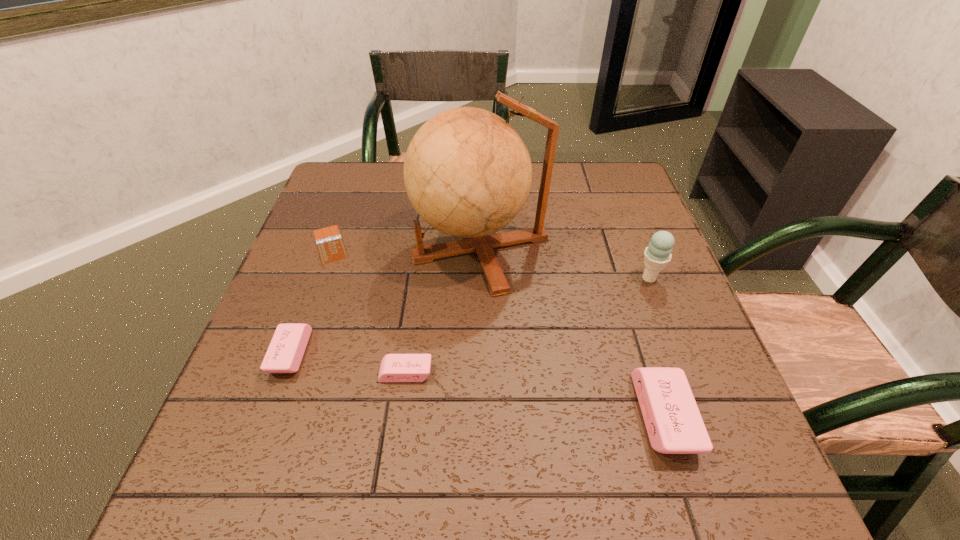
At what (x,y) coordinates should I click in order to perform the action: click on chocolate bar present at the left edge. Please return your answer as a coordinate pair (x, y). Image resolution: width=960 pixels, height=540 pixels. Looking at the image, I should click on (330, 245).

Where is `eraser located in the right edge section of the desktop`? The image size is (960, 540). eraser located in the right edge section of the desktop is located at coordinates (674, 424).

This screenshot has width=960, height=540. I want to click on ice cream at the right edge, so click(x=657, y=255).

Locate an element on the screen. object positioned at the near right corner is located at coordinates (674, 424).

You are a GUI agent. You are given a task and a screenshot of the screen. Output one action in this format:
    pyautogui.click(x=<x>, y=<y>)
    Task: Click on the free space at the far edge of the desktop
    This screenshot has height=540, width=960.
    Given the screenshot: What is the action you would take?
    pyautogui.click(x=571, y=193)

The height and width of the screenshot is (540, 960). Identify the location of free space at the right edge of the desktop. (641, 223).

Locate an element on the screen. The image size is (960, 540). vacant area at the far left corner is located at coordinates (365, 195).

At what (x,y) coordinates should I click in order to perform the action: click on free space at the far right corner of the desktop. Please return your answer as a coordinate pair (x, y). The height and width of the screenshot is (540, 960). Looking at the image, I should click on (590, 171).

This screenshot has height=540, width=960. Identify the location of vacant point located between the rightmost eraser and the tallest object. (572, 332).

Locate an element on the screen. This screenshot has height=540, width=960. empty location between the third shortest object and the tallest eraser is located at coordinates (477, 384).